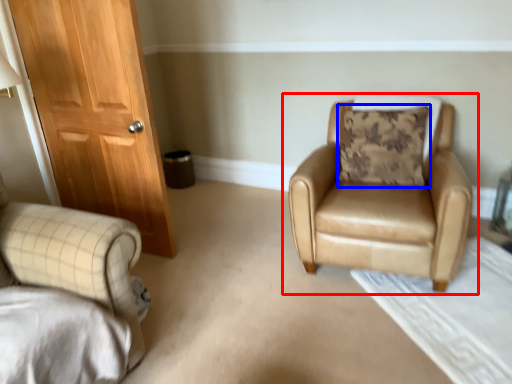
Question: Which point is further to the camera, chair (highlighted by a red box) or pillow (highlighted by a blue box)?

Choices:
 (A) chair
 (B) pillow

Answer: (B)